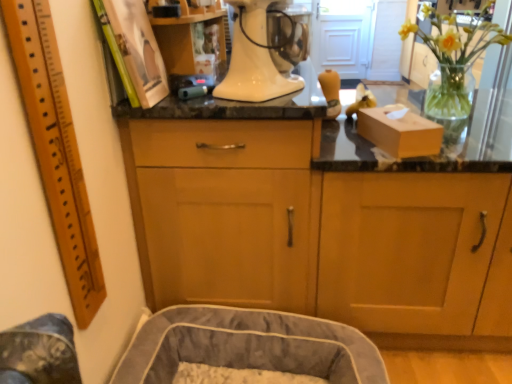
Question: Is point (344, 360) closer or farther from the camera than point (418, 230)?

Choices:
 (A) farther
 (B) closer

Answer: (B)

Question: Considering the positions of soft gray fabric dog bed at lower left and wooden cabinet at center, acting as the 2th cabinetry starting from the left, in the image, is soft gray fabric dog bed at lower left taller or shorter than wooden cabinet at center, acting as the 2th cabinetry starting from the left,?

Choices:
 (A) tall
 (B) short

Answer: (B)

Question: Estimate the real-world distances between objects in this image. Which object is farther from the wooden cabinet at center, acting as the 2th cabinetry starting from the left?

Choices:
 (A) matte cardboard box at right
 (B) wooden cabinet at center, acting as the 2th cabinetry starting from the right
 (C) soft gray fabric dog bed at lower left
 (D) white glossy stand mixer at center
 (E) wooden ruler at left

Answer: (E)

Question: Based on their relative distances, which object is nearer to the wooden ruler at left?

Choices:
 (A) white glossy stand mixer at center
 (B) wooden cabinet at center, placed as the 1th cabinetry when sorted from left to right
 (C) soft gray fabric dog bed at lower left
 (D) matte cardboard box at right
 (E) wooden cabinet at center, acting as the first cabinetry starting from the right

Answer: (B)